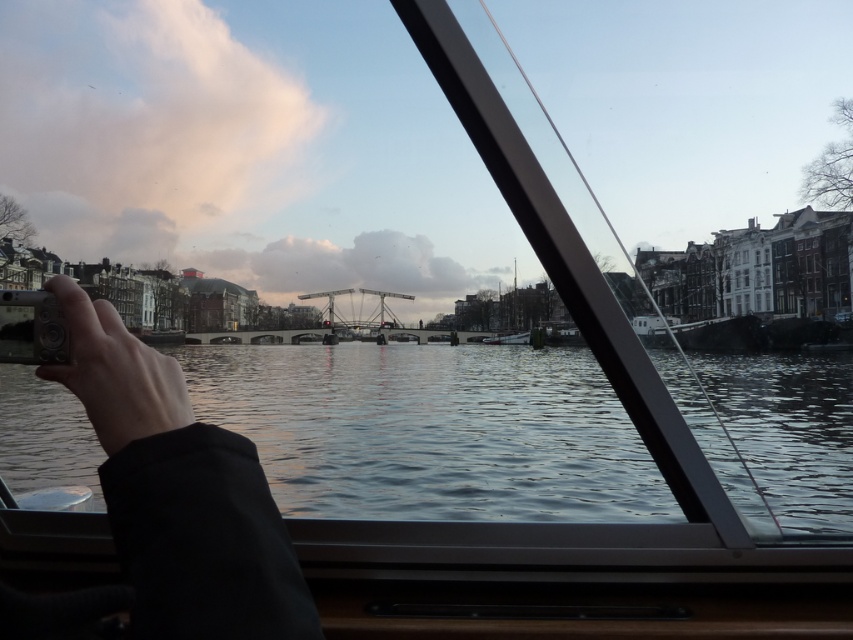
You are on a boat and want to take a photo of the glossy water at center. The metallic silver camera at lower left is in your hand. Can you hold the camera higher than the water to get a better angle?

The glossy water at center is much taller than the metallic silver camera at lower left. Since the water is taller, you can lift the camera higher to capture the scene from above.

You are a photographer trying to position your two cameras on the boat window ledge. You have a metallic silver camera at lower left and a matte black camera at lower left. Based on the scene, which camera is on the right side when viewed from the boat?

The metallic silver camera at lower left is positioned on the right side of the matte black camera at lower left.

In the scene shown: You are inside a boat and looking through the window. There is a point marked at coordinates (431,429). Based on the scene description, what does this point most likely represent?

The point at coordinates (431,429) most likely represents glossy water at center as described in the scene.